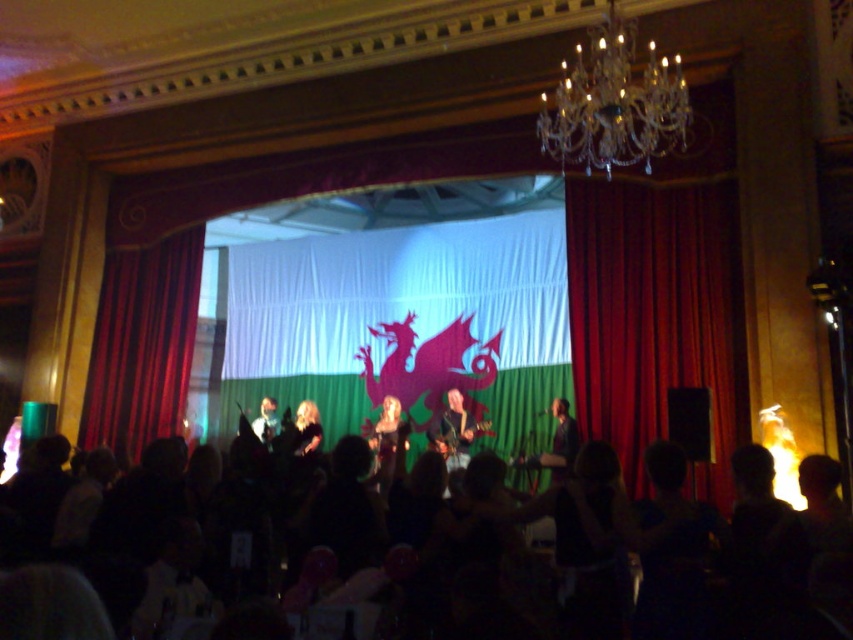
What is the position of the matte black guitar at center relative to the smooth black shirt at center?

The matte black guitar at center is positioned to the right of the smooth black shirt at center.